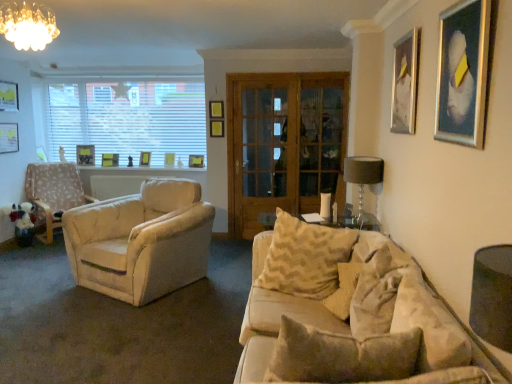
Question: Can you confirm if matte yellow picture frame at upper center, which is the 5th picture frame in right-to-left order, is bigger than metallic silver picture frame at upper right, which is the 1th picture frame from right to left?

Choices:
 (A) no
 (B) yes

Answer: (A)

Question: Is matte yellow picture frame at upper center, arranged as the 5th picture frame when viewed from the left, aimed at metallic silver picture frame at upper right, acting as the second picture frame starting from the front?

Choices:
 (A) yes
 (B) no

Answer: (B)

Question: Considering the relative sizes of matte yellow picture frame at upper center, which is the 6th picture frame in front-to-back order, and metallic silver picture frame at upper right, the ninth picture frame viewed from the left, in the image provided, is matte yellow picture frame at upper center, which is the 6th picture frame in front-to-back order, wider than metallic silver picture frame at upper right, the ninth picture frame viewed from the left,?

Choices:
 (A) no
 (B) yes

Answer: (B)

Question: From the image's perspective, is matte yellow picture frame at upper center, which is the 6th picture frame in front-to-back order, under metallic silver picture frame at upper right, which is the 1th picture frame from right to left?

Choices:
 (A) no
 (B) yes

Answer: (B)

Question: Is matte yellow picture frame at upper center, which is the 5th picture frame in right-to-left order, thinner than metallic silver picture frame at upper right, marked as the eighth picture frame in a back-to-front arrangement?

Choices:
 (A) yes
 (B) no

Answer: (B)

Question: Can you see matte yellow picture frame at upper center, arranged as the 5th picture frame when viewed from the left, touching metallic silver picture frame at upper right, marked as the eighth picture frame in a back-to-front arrangement?

Choices:
 (A) no
 (B) yes

Answer: (A)

Question: Is beige soft pillow at lower right, acting as the third pillow starting from the back, positioned beyond the bounds of matte black picture frame at upper left, which is the 3th picture frame from left to right?

Choices:
 (A) yes
 (B) no

Answer: (A)

Question: From a real-world perspective, is beige soft pillow at lower right, acting as the third pillow starting from the back, located higher than matte black picture frame at upper left, which is the 3th picture frame from left to right?

Choices:
 (A) yes
 (B) no

Answer: (B)

Question: Is beige soft pillow at lower right, acting as the third pillow starting from the back, placed right next to matte black picture frame at upper left, which is the 1th picture frame in back-to-front order?

Choices:
 (A) yes
 (B) no

Answer: (B)

Question: From the image's perspective, is beige soft pillow at lower right, the 1th pillow when ordered from front to back, over matte black picture frame at upper left, which is the 3th picture frame from left to right?

Choices:
 (A) no
 (B) yes

Answer: (A)

Question: Is beige soft pillow at lower right, the 1th pillow when ordered from front to back, taller than matte black picture frame at upper left, which is counted as the 9th picture frame, starting from the front?

Choices:
 (A) no
 (B) yes

Answer: (B)

Question: Is beige soft pillow at lower right, the 1th pillow when ordered from front to back, looking in the opposite direction of matte black picture frame at upper left, which is counted as the 9th picture frame, starting from the front?

Choices:
 (A) no
 (B) yes

Answer: (A)

Question: Considering the relative sizes of beige textured pillow at center, the 1th pillow in the back-to-front sequence, and metallic silver picture frame at upper right, marked as the eighth picture frame in a back-to-front arrangement, in the image provided, is beige textured pillow at center, the 1th pillow in the back-to-front sequence, thinner than metallic silver picture frame at upper right, marked as the eighth picture frame in a back-to-front arrangement,?

Choices:
 (A) yes
 (B) no

Answer: (B)